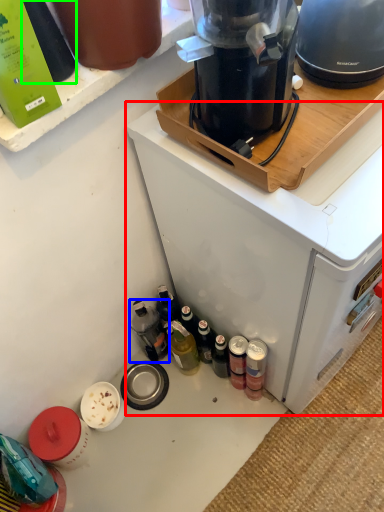
Question: Which object is positioned closest to home appliance (highlighted by a red box)? Select from bottle (highlighted by a blue box) and bottle (highlighted by a green box).

Choices:
 (A) bottle
 (B) bottle

Answer: (A)